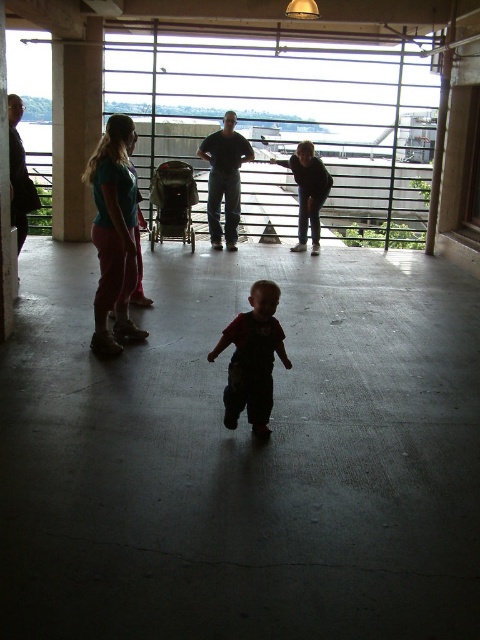
Question: Can you confirm if dark red overalls at center is thinner than green fabric stroller at center?

Choices:
 (A) yes
 (B) no

Answer: (A)

Question: Does dark red overalls at center come in front of green fabric stroller at center?

Choices:
 (A) yes
 (B) no

Answer: (A)

Question: Which point appears farthest from the camera in this image?

Choices:
 (A) (164, 237)
 (B) (225, 387)

Answer: (A)

Question: Which point is closer to the camera?

Choices:
 (A) (267, 435)
 (B) (160, 188)

Answer: (A)

Question: Which point is farther from the camera taking this photo?

Choices:
 (A) (158, 176)
 (B) (235, 365)

Answer: (A)

Question: Can you confirm if dark red overalls at center is positioned above green fabric stroller at center?

Choices:
 (A) yes
 (B) no

Answer: (B)